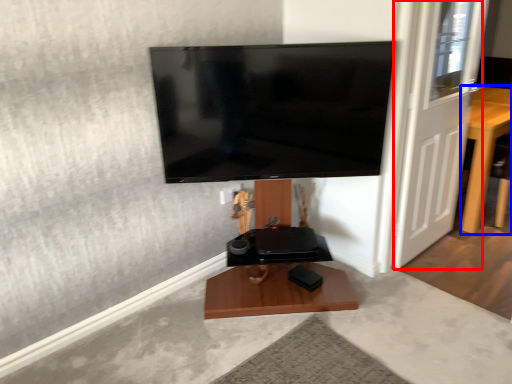
Question: Which object is further to the camera taking this photo, door (highlighted by a red box) or furniture (highlighted by a blue box)?

Choices:
 (A) door
 (B) furniture

Answer: (B)